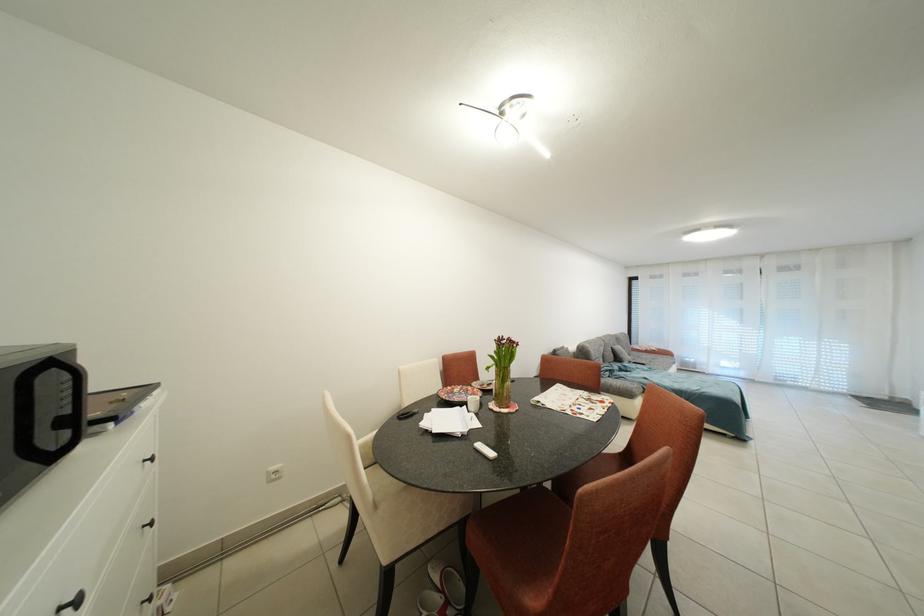
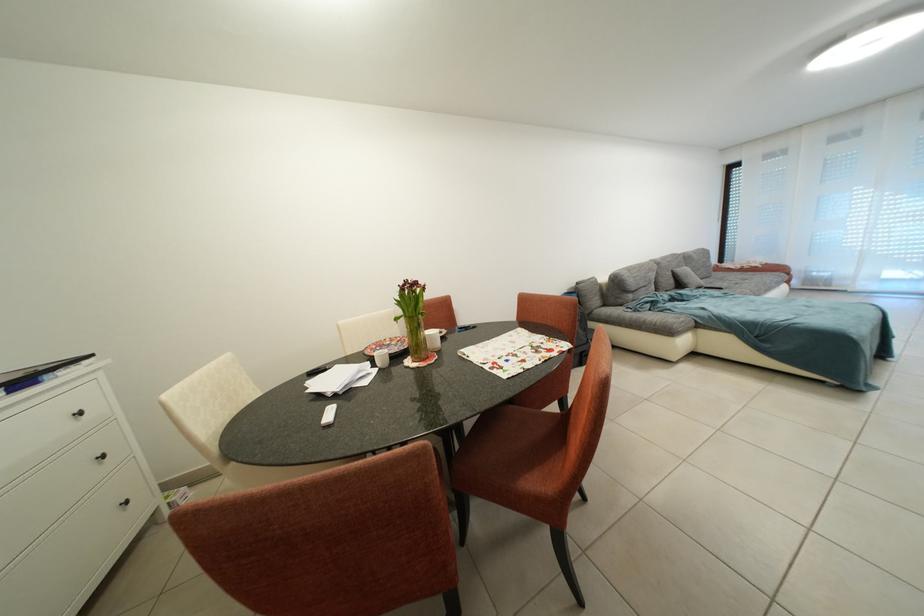
Question: The camera is either moving clockwise (left) or counter-clockwise (right) around the object. The first image is from the beginning of the video and the second image is from the end. Is the camera moving left or right when shooting the video?

Choices:
 (A) Left
 (B) Right

Answer: (B)